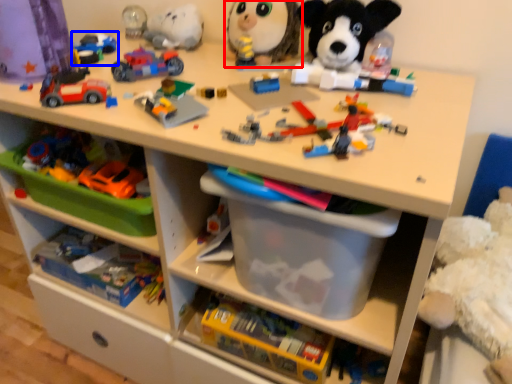
Question: Among these objects, which one is farthest to the camera, toy (highlighted by a red box) or toy (highlighted by a blue box)?

Choices:
 (A) toy
 (B) toy

Answer: (B)